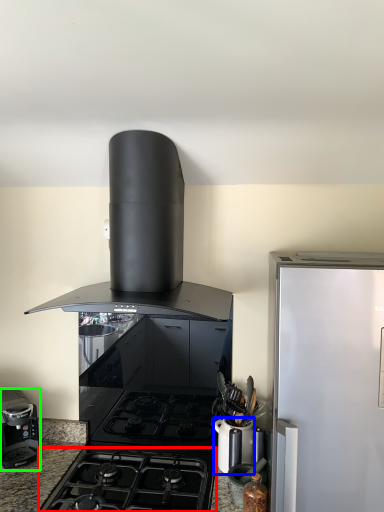
Question: Based on their relative distances, which object is farther from gas stove (highlighted by a red box)? Choose from kitchen appliance (highlighted by a blue box) and kitchen appliance (highlighted by a green box).

Choices:
 (A) kitchen appliance
 (B) kitchen appliance

Answer: (B)